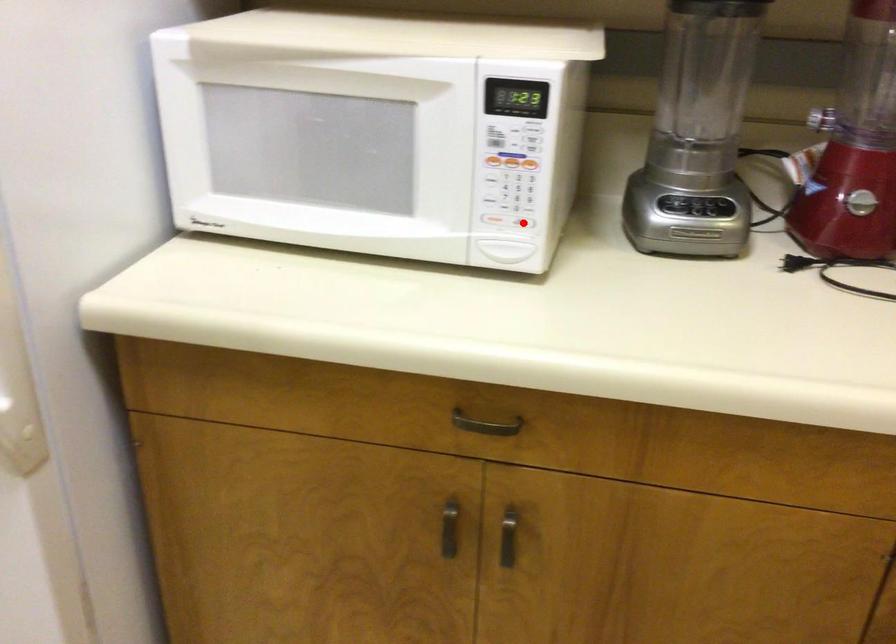
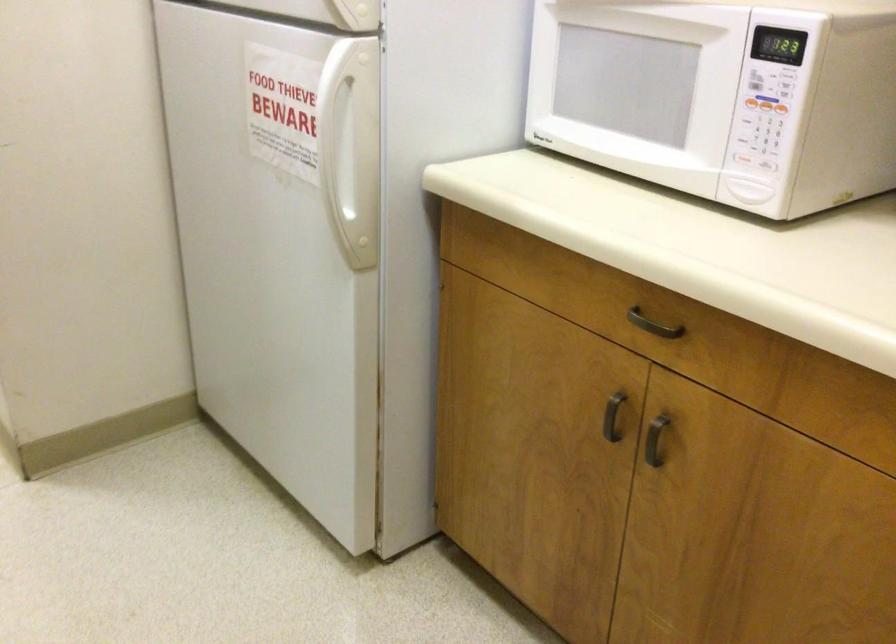
The point at the highlighted location is marked in the first image. Where is the corresponding point in the second image?

(764, 164)